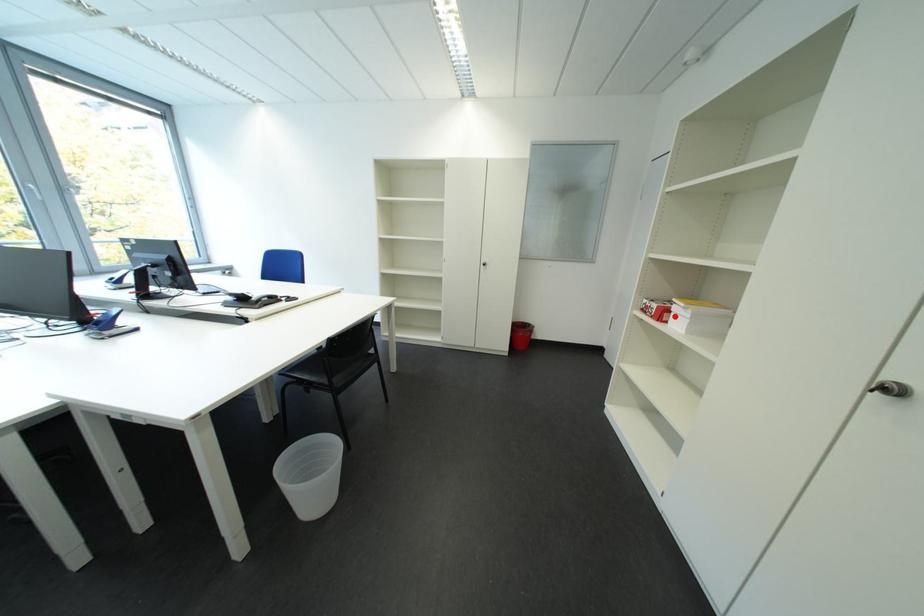
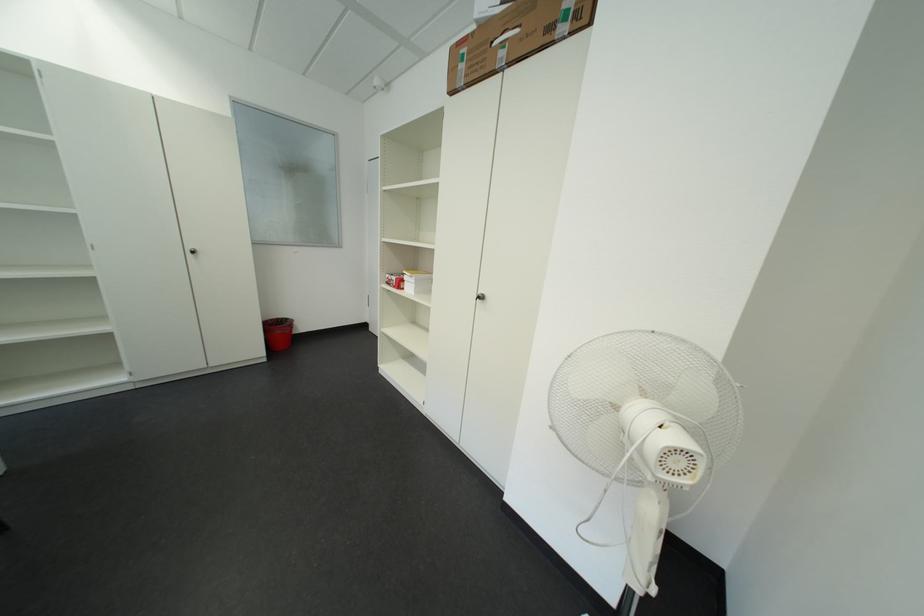
Question: I am providing you with two images of the same scene from different viewpoints. A red point is marked on the first image. Is the red point's position out of view in image 2?

Choices:
 (A) Yes
 (B) No

Answer: (B)